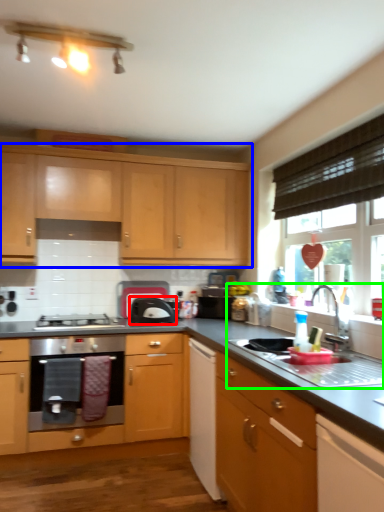
Question: Based on their relative distances, which object is nearer to kitchen appliance (highlighted by a red box)? Choose from cabinetry (highlighted by a blue box) and sink (highlighted by a green box).

Choices:
 (A) cabinetry
 (B) sink

Answer: (A)